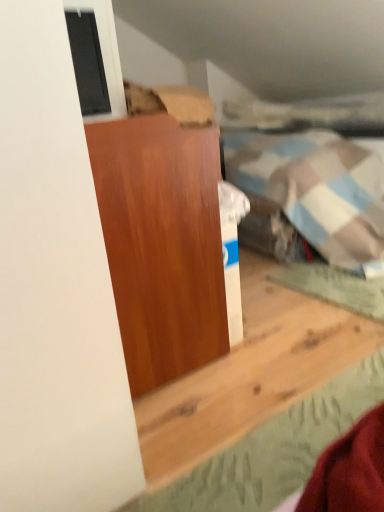
I want to click on matte wood cabinet at center, so click(162, 244).

The image size is (384, 512). Describe the element at coordinates (162, 244) in the screenshot. I see `matte wood cabinet at center` at that location.

You are a GUI agent. You are given a task and a screenshot of the screen. Output one action in this format:
    pyautogui.click(x=<x>, y=<y>)
    Task: Click on the matte glass window at upper left
    
    Given the screenshot: What is the action you would take?
    pyautogui.click(x=105, y=54)

Describe the element at coordinates (105, 54) in the screenshot. This screenshot has width=384, height=512. I see `matte glass window at upper left` at that location.

At what (x,y) coordinates should I click in order to perform the action: click on matte wood cabinet at center. Please return your answer as a coordinate pair (x, y). This screenshot has height=512, width=384. Looking at the image, I should click on (162, 244).

Between matte glass window at upper left and matte wood cabinet at center, which one appears on the right side from the viewer's perspective?

Positioned to the right is matte wood cabinet at center.

Is matte glass window at upper left in front of or behind matte wood cabinet at center in the image?

Clearly, matte glass window at upper left is behind matte wood cabinet at center.

Is point (101, 28) closer or farther from the camera than point (116, 250)?

Point (101, 28) is farther from the camera than point (116, 250).

From the image's perspective, which is below, matte glass window at upper left or matte wood cabinet at center?

matte wood cabinet at center appears lower in the image.

From a real-world perspective, who is located higher, matte glass window at upper left or matte wood cabinet at center?

matte glass window at upper left.

Looking at this image, which object is wider, matte glass window at upper left or matte wood cabinet at center?

Wider between the two is matte wood cabinet at center.

Between matte glass window at upper left and matte wood cabinet at center, which one has more height?

With more height is matte wood cabinet at center.

Can you confirm if matte glass window at upper left is bigger than matte wood cabinet at center?

Incorrect, matte glass window at upper left is not larger than matte wood cabinet at center.

Is matte glass window at upper left surrounding matte wood cabinet at center?

Definitely not — matte wood cabinet at center is not inside matte glass window at upper left.

Are matte glass window at upper left and matte wood cabinet at center making contact?

matte glass window at upper left and matte wood cabinet at center are not in contact.

Is matte glass window at upper left oriented towards matte wood cabinet at center?

No, matte glass window at upper left does not turn towards matte wood cabinet at center.

Where is `furniture in front of the matte glass window at upper left`? This screenshot has height=512, width=384. furniture in front of the matte glass window at upper left is located at coordinates (162, 244).

From the picture: Is matte wood cabinet at center to the left of matte glass window at upper left from the viewer's perspective?

Incorrect, matte wood cabinet at center is not on the left side of matte glass window at upper left.

Relative to matte glass window at upper left, is matte wood cabinet at center in front or behind?

Clearly, matte wood cabinet at center is in front of matte glass window at upper left.

Considering the positions of point (131, 212) and point (119, 93), is point (131, 212) closer or farther from the camera than point (119, 93)?

Point (131, 212) is closer to the camera than point (119, 93).

From the image's perspective, is matte wood cabinet at center above matte glass window at upper left?

No.

From a real-world perspective, is matte wood cabinet at center beneath matte glass window at upper left?

Yes, from a real-world perspective, matte wood cabinet at center is under matte glass window at upper left.

Can you confirm if matte wood cabinet at center is thinner than matte glass window at upper left?

Incorrect, the width of matte wood cabinet at center is not less than that of matte glass window at upper left.

Who is shorter, matte wood cabinet at center or matte glass window at upper left?

matte glass window at upper left.

Which of these two, matte wood cabinet at center or matte glass window at upper left, is smaller?

With smaller size is matte glass window at upper left.

Would you say matte wood cabinet at center is inside or outside matte glass window at upper left?

matte wood cabinet at center exists outside the volume of matte glass window at upper left.

Is matte wood cabinet at center in contact with matte glass window at upper left?

No, matte wood cabinet at center is not with matte glass window at upper left.

Is matte wood cabinet at center looking in the opposite direction of matte glass window at upper left?

No, matte wood cabinet at center is not facing away from matte glass window at upper left.

How different are the orientations of matte wood cabinet at center and matte glass window at upper left in degrees?

0.697 degrees.

How far apart are matte wood cabinet at center and matte glass window at upper left?

matte wood cabinet at center is 24.29 inches away from matte glass window at upper left.

Locate an element on the screen. furniture in front of the matte glass window at upper left is located at coordinates (162, 244).

Find the location of a particular element. furniture that is in front of the matte glass window at upper left is located at coordinates (162, 244).

Where is `furniture on the right of matte glass window at upper left`? furniture on the right of matte glass window at upper left is located at coordinates (162, 244).